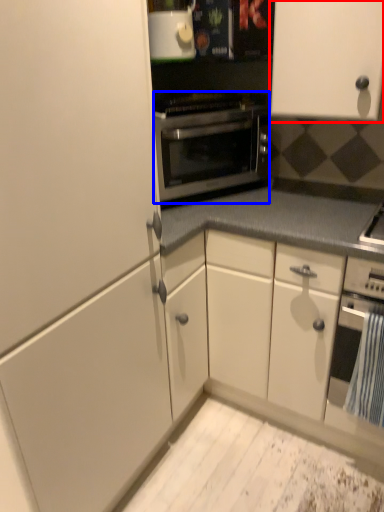
Question: Among these objects, which one is nearest to the camera, cabinetry (highlighted by a red box) or oven (highlighted by a blue box)?

Choices:
 (A) cabinetry
 (B) oven

Answer: (A)